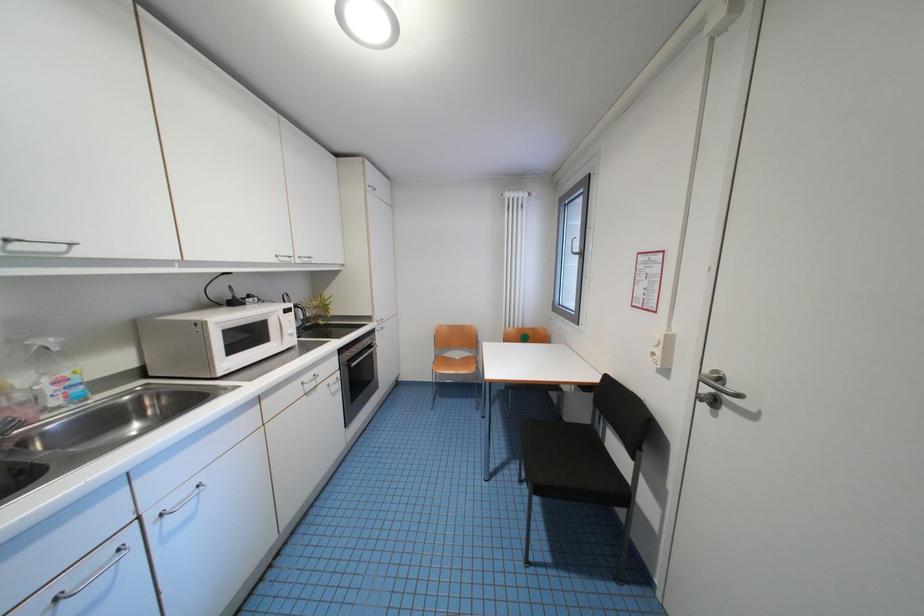
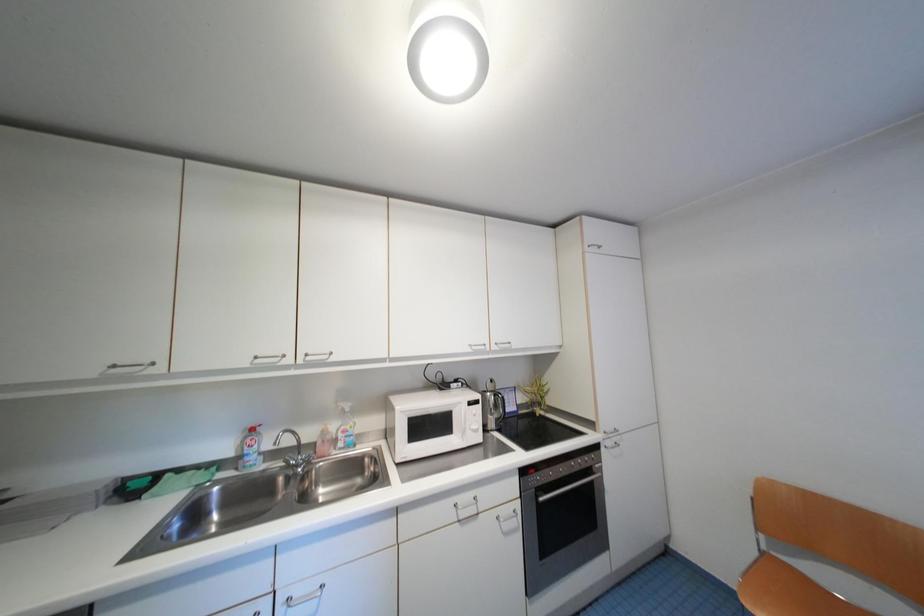
Question: Based on the continuous images, in which direction is the camera rotating? Reply with the corresponding letter.

Choices:
 (A) Left
 (B) Right
 (C) Up
 (D) Down

Answer: (A)